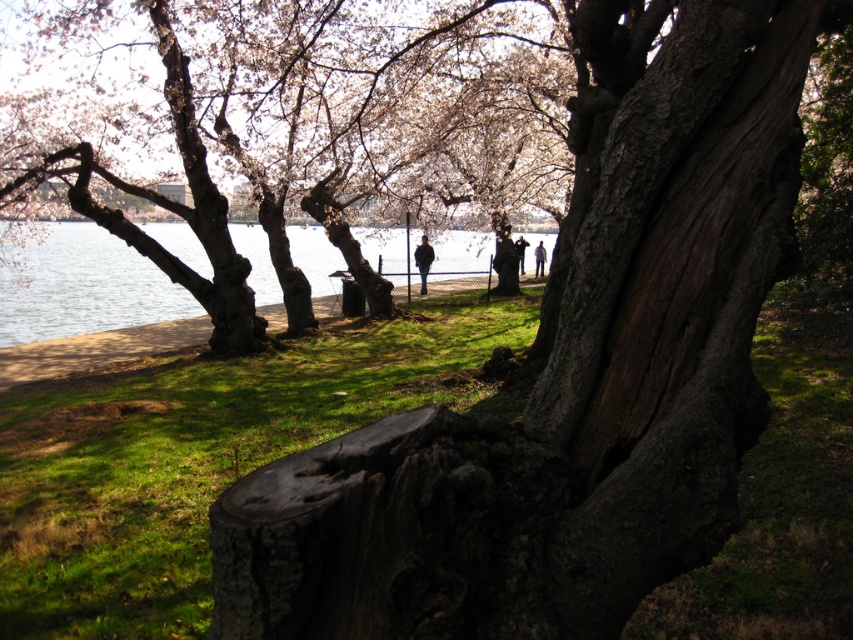
You are standing at the point marked as point (202, 456) in the image. What do you see immediately to your left?

At point (202, 456) lies green grass at lower left, so you would see green grass at lower left immediately to your left.

You are standing at the edge of the water and want to walk towards the smooth bark tree trunk at center. Which direction should you walk to avoid the green grass at lower left?

To avoid the green grass at lower left, walk towards the right side, as the smooth bark tree trunk at center is thinner than the green grass at lower left, indicating it might be closer or narrower, so moving right would lead you toward the tree trunk while bypassing the grass.